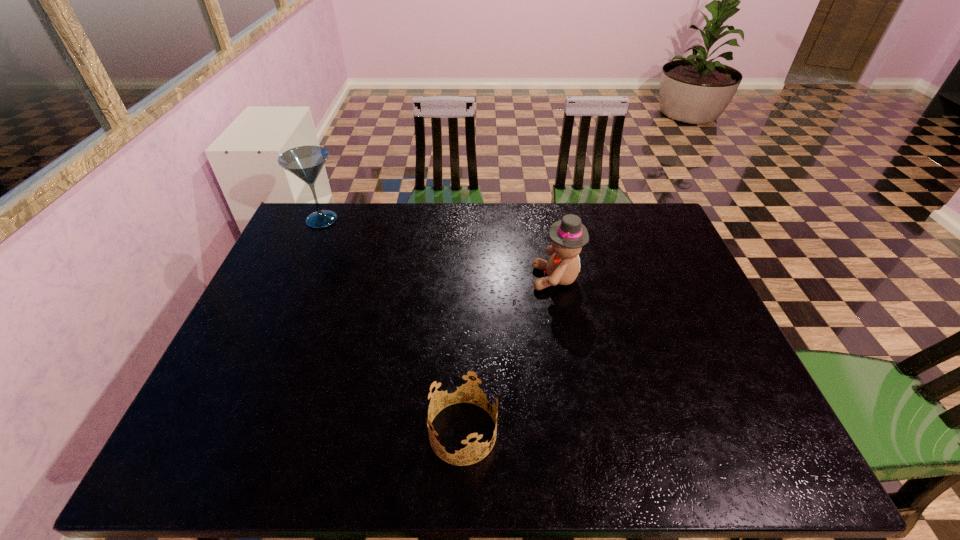
Identify the location of blank space located 0.220m on the back of the second object from right to left. (466, 328).

Locate an element on the screen. The width and height of the screenshot is (960, 540). object located at the far edge is located at coordinates (306, 162).

You are a GUI agent. You are given a task and a screenshot of the screen. Output one action in this format:
    pyautogui.click(x=<x>, y=<y>)
    Task: Click on the object that is at the near edge
    Image resolution: width=960 pixels, height=540 pixels.
    Given the screenshot: What is the action you would take?
    pyautogui.click(x=461, y=386)

You are a GUI agent. You are given a task and a screenshot of the screen. Output one action in this format:
    pyautogui.click(x=<x>, y=<y>)
    Task: Click on the object at the left edge
    The image size is (960, 540).
    Given the screenshot: What is the action you would take?
    pyautogui.click(x=306, y=162)

Where is `object that is at the far left corner`? object that is at the far left corner is located at coordinates (306, 162).

At what (x,y) coordinates should I click in order to perform the action: click on vacant space at the far edge of the desktop. Please return your answer as a coordinate pair (x, y). Looking at the image, I should click on (525, 234).

You are a GUI agent. You are given a task and a screenshot of the screen. Output one action in this format:
    pyautogui.click(x=<x>, y=<y>)
    Task: Click on the vacant space at the left edge of the desktop
    The height and width of the screenshot is (540, 960).
    Given the screenshot: What is the action you would take?
    pyautogui.click(x=306, y=318)

The height and width of the screenshot is (540, 960). In the image, there is a desktop. Find the location of `vacant region at the right edge`. vacant region at the right edge is located at coordinates (x=673, y=314).

Where is `free location at the far left corner`? The width and height of the screenshot is (960, 540). free location at the far left corner is located at coordinates (316, 240).

Identify the location of free space between the second farthest object and the farthest object. This screenshot has height=540, width=960. (439, 249).